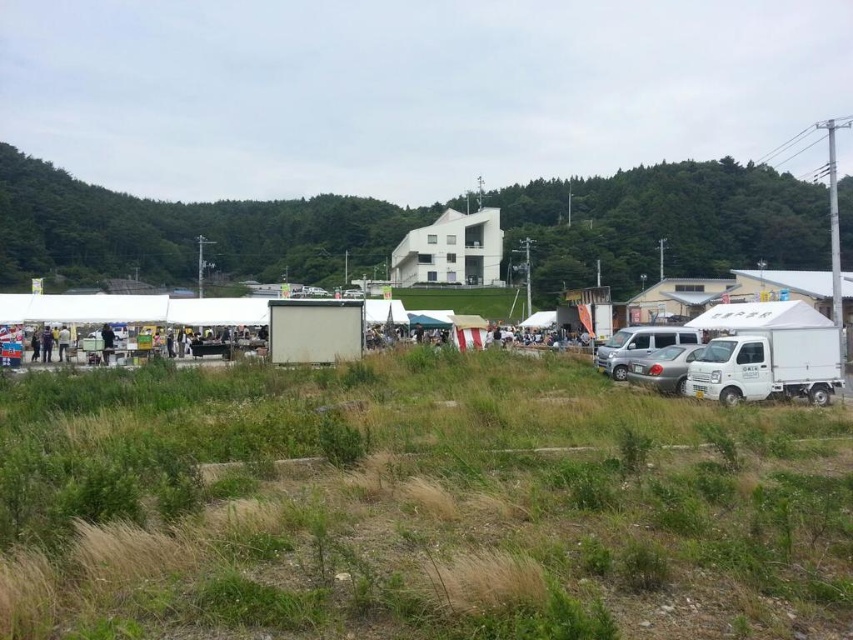
Does white matte truck at right have a smaller size compared to silver metallic van at right?

Indeed, white matte truck at right has a smaller size compared to silver metallic van at right.

Based on the photo, is white matte truck at right bigger than silver metallic van at right?

Actually, white matte truck at right might be smaller than silver metallic van at right.

Locate an element on the screen. This screenshot has height=640, width=853. white matte truck at right is located at coordinates (764, 353).

Between white matte truck at lower right and dark blue shirt at left, which one appears on the right side from the viewer's perspective?

From the viewer's perspective, white matte truck at lower right appears more on the right side.

Does white matte truck at lower right have a larger size compared to dark blue shirt at left?

Indeed, white matte truck at lower right has a larger size compared to dark blue shirt at left.

Which is in front, point (683, 372) or point (64, 349)?

Point (683, 372) is in front.

Image resolution: width=853 pixels, height=640 pixels. Find the location of `white matte truck at lower right`. white matte truck at lower right is located at coordinates (663, 368).

Is white matte truck at right to the left of dark blue shirt at left from the viewer's perspective?

In fact, white matte truck at right is to the right of dark blue shirt at left.

Which is in front, point (833, 332) or point (68, 326)?

Point (833, 332) is more forward.

Where is `white matte truck at right`? white matte truck at right is located at coordinates (764, 353).